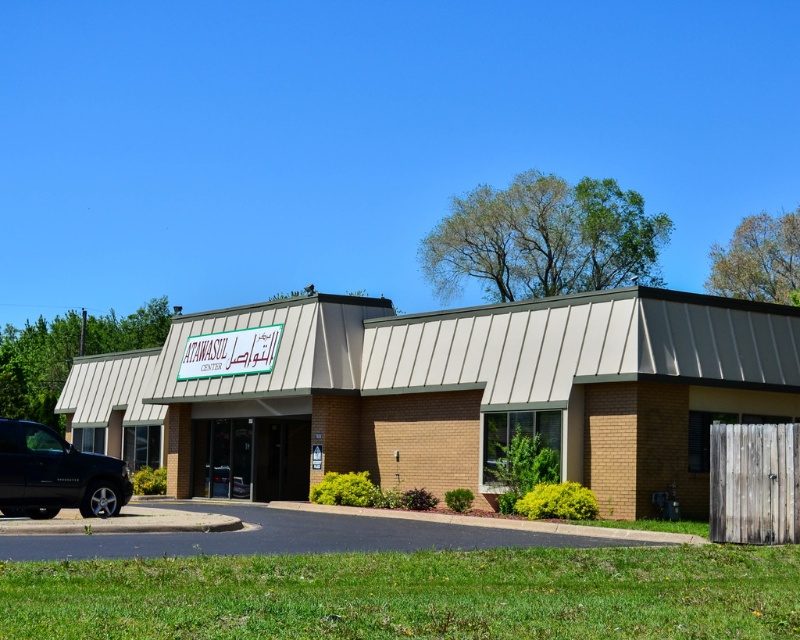
Measure the distance between point (654, 433) and camera.

They are 19.20 meters apart.

Is brown brick building at center taller than white plastic sign at center?

Yes.

Find the location of a particular element. brown brick building at center is located at coordinates (450, 394).

Which of these two, shiny black truck at lower left or white plastic sign at center, stands taller?

With more height is shiny black truck at lower left.

Does shiny black truck at lower left have a smaller size compared to white plastic sign at center?

Indeed, shiny black truck at lower left has a smaller size compared to white plastic sign at center.

The height and width of the screenshot is (640, 800). In order to click on shiny black truck at lower left in this screenshot , I will do `click(56, 474)`.

Who is taller, brown brick building at center or shiny black truck at lower left?

Standing taller between the two is brown brick building at center.

Can you confirm if brown brick building at center is positioned above shiny black truck at lower left?

Yes.

Does point (140, 444) lie behind point (46, 433)?

Yes, it is.

In order to click on brown brick building at center in this screenshot , I will do `click(450, 394)`.